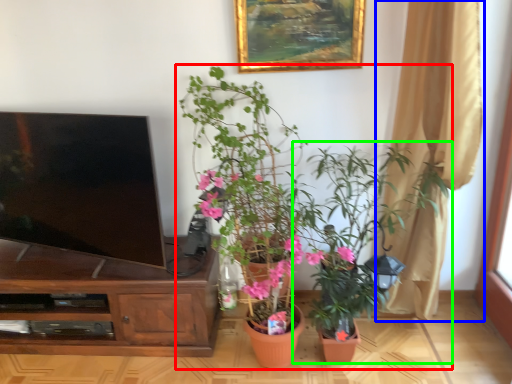
Question: Estimate the real-world distances between objects in this image. Which object is farther from houseplant (highlighted by a red box), curtain (highlighted by a blue box) or houseplant (highlighted by a green box)?

Choices:
 (A) curtain
 (B) houseplant

Answer: (A)